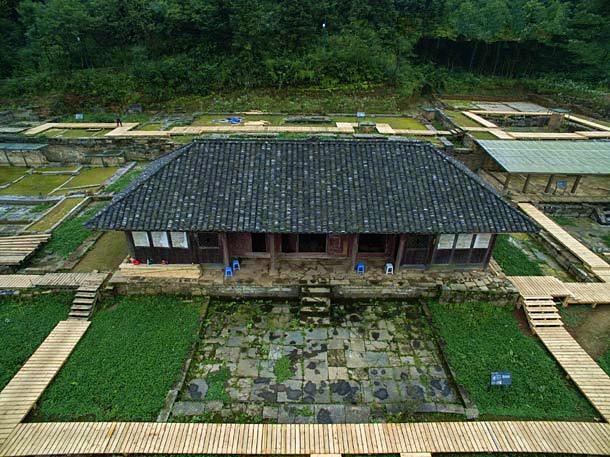
Identify the location of board. Image resolution: width=610 pixels, height=457 pixels. (498, 380).